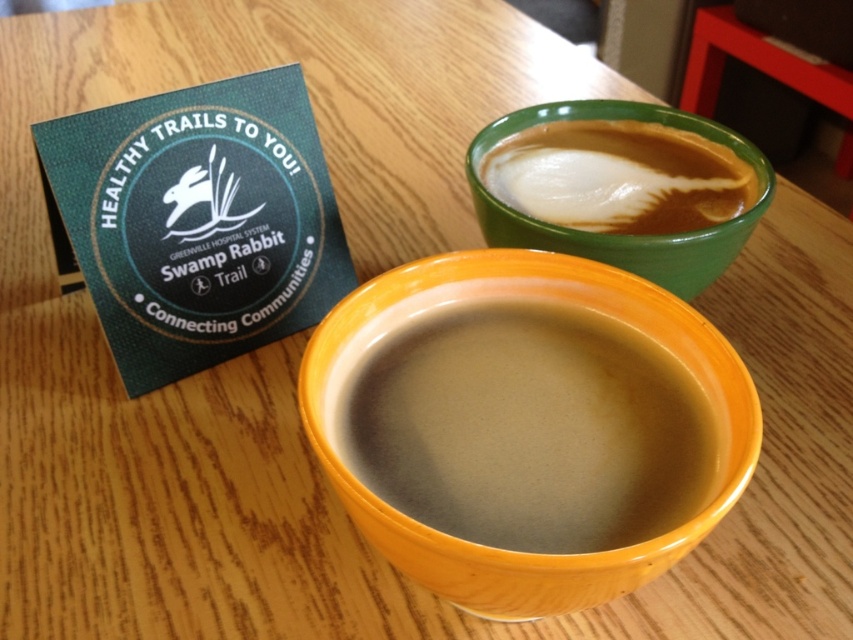
This screenshot has width=853, height=640. What are the coordinates of `matte ceramic mug at center` in the screenshot? It's located at (529, 429).

Is matte ceramic mug at center smaller than smooth green cup at upper right?

Incorrect, matte ceramic mug at center is not smaller in size than smooth green cup at upper right.

Between point (521, 509) and point (608, 122), which one is positioned in front?

Point (521, 509)

The width and height of the screenshot is (853, 640). What are the coordinates of `matte ceramic mug at center` in the screenshot? It's located at (529, 429).